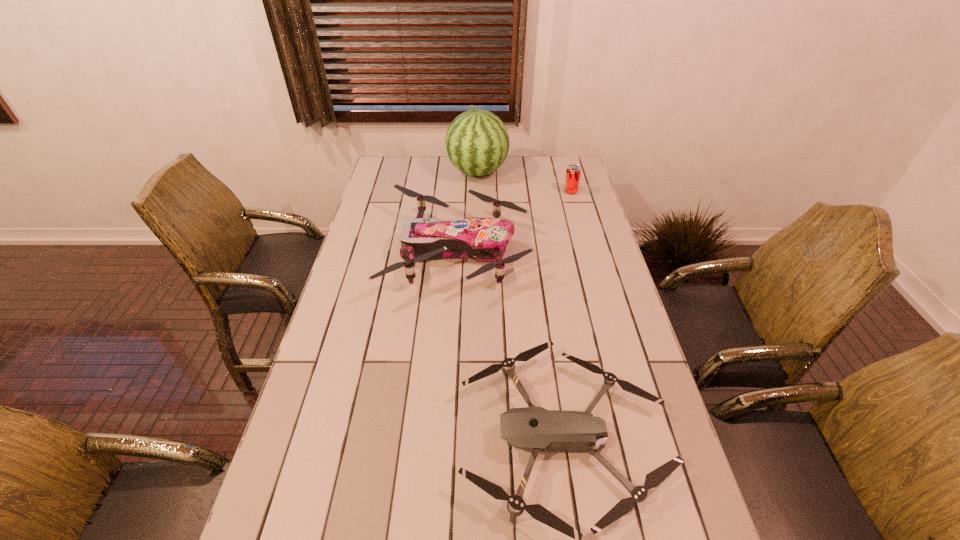
You are a GUI agent. You are given a task and a screenshot of the screen. Output one action in this format:
    pyautogui.click(x=<x>, y=<y>)
    Task: Click on the vacant space at the far edge
    This screenshot has width=960, height=540.
    Given the screenshot: What is the action you would take?
    pyautogui.click(x=439, y=171)

Locate an element on the screen. The image size is (960, 540). vacant area at the left edge is located at coordinates coord(342,286).

Locate an element on the screen. vacant space at the right edge is located at coordinates (579, 198).

This screenshot has height=540, width=960. In the image, there is a desktop. Find the location of `vacant space at the far right corner`. vacant space at the far right corner is located at coordinates (563, 177).

Find the location of a particular element. This screenshot has height=540, width=960. free space between the tallest object and the third farthest object is located at coordinates (468, 212).

What are the coordinates of `free spot between the soda can and the watermelon` in the screenshot? It's located at (524, 181).

Where is `free spot between the tallest object and the farther drone`? The image size is (960, 540). free spot between the tallest object and the farther drone is located at coordinates (468, 212).

At what (x,y) coordinates should I click in order to perform the action: click on unoccupied position between the watermelon and the taller drone. Please return your answer as a coordinate pair (x, y). Looking at the image, I should click on (468, 212).

Image resolution: width=960 pixels, height=540 pixels. I want to click on object that ranks as the second closest to the farther drone, so click(x=533, y=428).

Identify the location of the third closest object to the third farthest object. (573, 172).